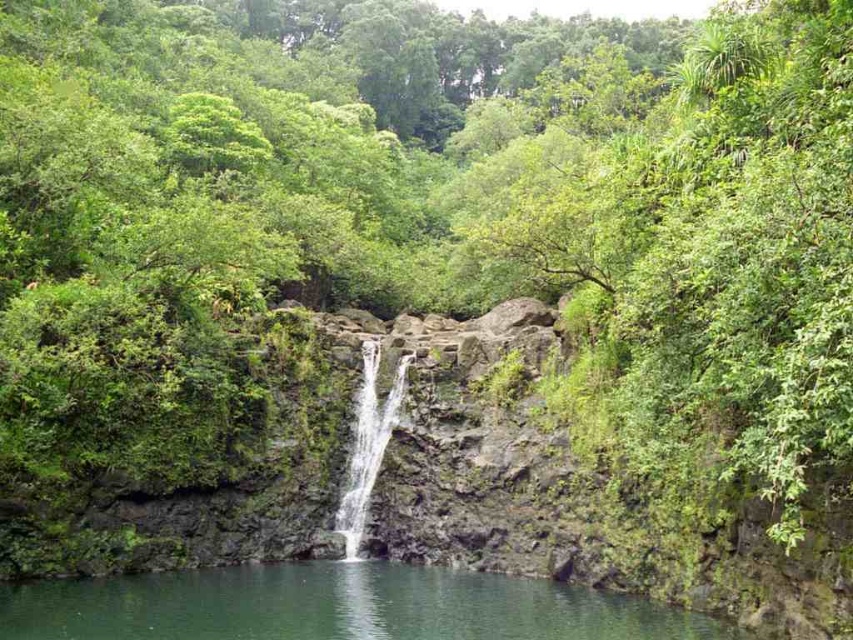
You are standing at the edge of the scene and want to reach the green smooth water at center. Based on the coordinates provided in the Objects Description, in which direction should you move relative to your current position?

The green smooth water at center is located at coordinates point (x=335, y=605), so you should move towards the center of the scene to reach it.

You are a kayaker planning to navigate through the green smooth water at center and the clear water at center. Which water area is wider so that your kayak can fit through comfortably?

The green smooth water at center is wider than the clear water at center, so the kayak can fit through the green smooth water at center more comfortably.

You are standing at the base of the waterfall in the serene natural scene. You notice two points marked in the image. The first point is at coordinate point (614, 600), and the second point is at coordinate point (350, 470). From your current position, which point is closer to you?

Point (614, 600) is in front of point (350, 470), so from your current position at the base of the waterfall, point (614, 600) is closer to you.